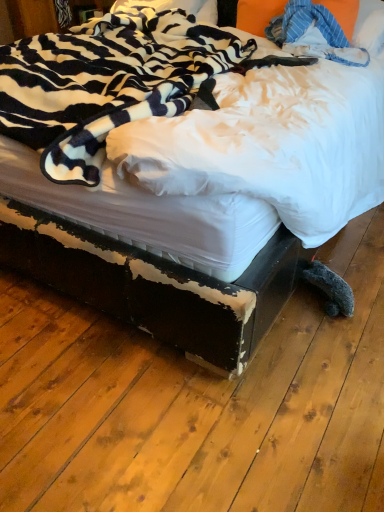
What do you see at coordinates (155, 284) in the screenshot? The image size is (384, 512). I see `white soft bed at center` at bounding box center [155, 284].

What is the approximate height of white soft bed at center?

1.03 meters.

Image resolution: width=384 pixels, height=512 pixels. In order to click on white soft bed at center in this screenshot , I will do `click(155, 284)`.

This screenshot has width=384, height=512. In order to click on white soft bed at center in this screenshot , I will do `click(155, 284)`.